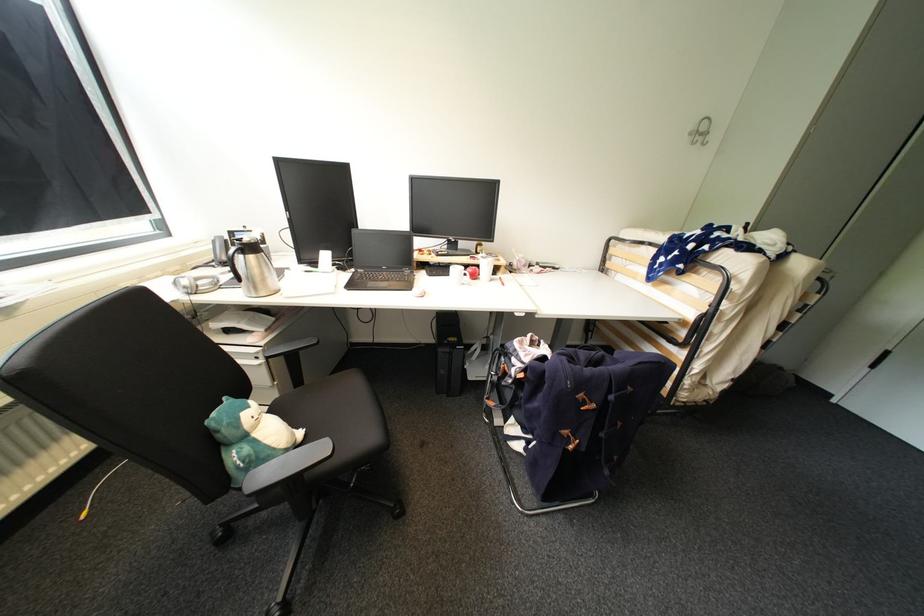
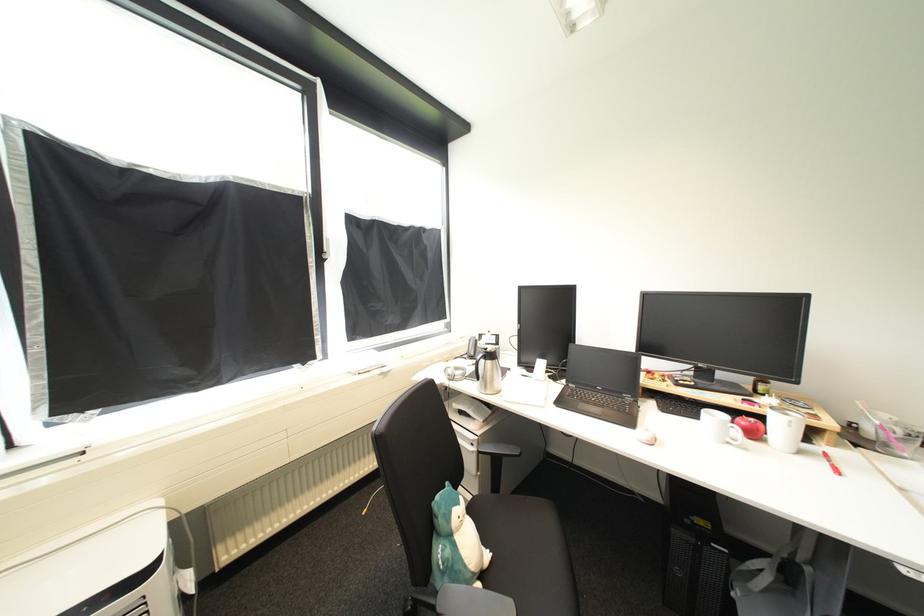
Locate, in the second image, the point that corresponds to (220,241) in the first image.

(477, 341)